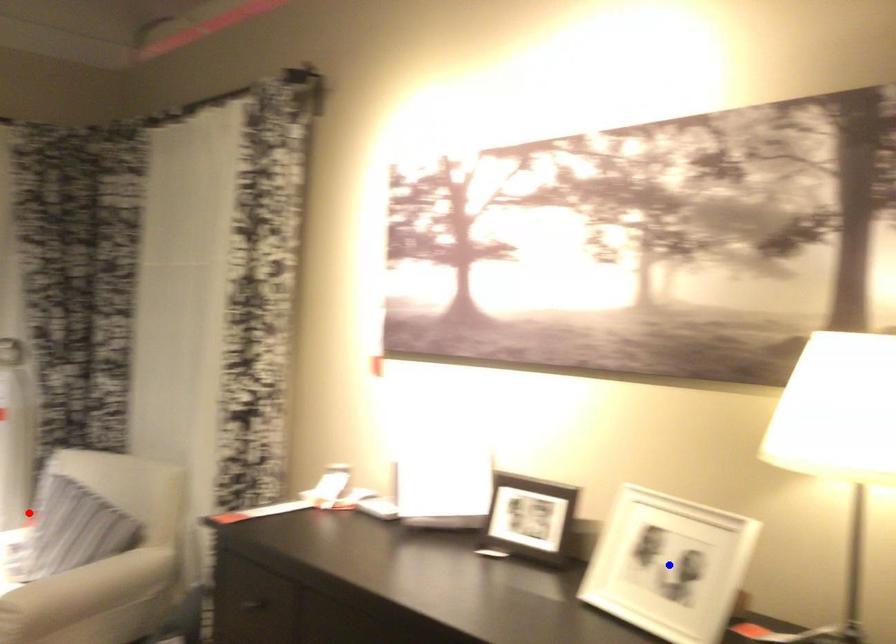
Question: Which of the two points in the image is closer to the camera?

Choices:
 (A) Blue point is closer.
 (B) Red point is closer.

Answer: (A)